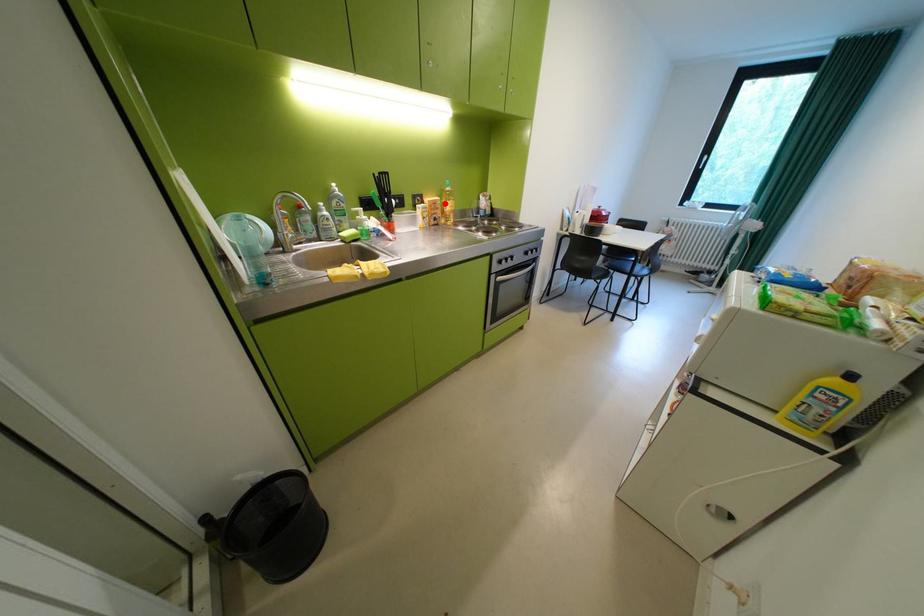
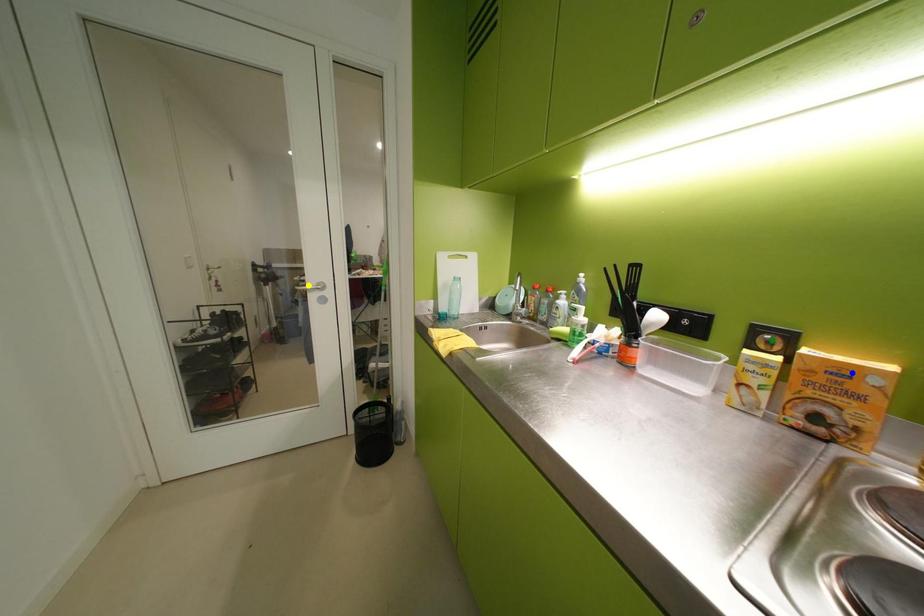
Question: I am providing you with two images of the same scene from different viewpoints. A red point is marked on the first image. You are given multiple points on the second image. Can you choose the point in image 2 that corresponds to the point in image 1?

Choices:
 (A) blue point
 (B) yellow point
 (C) green point

Answer: (A)